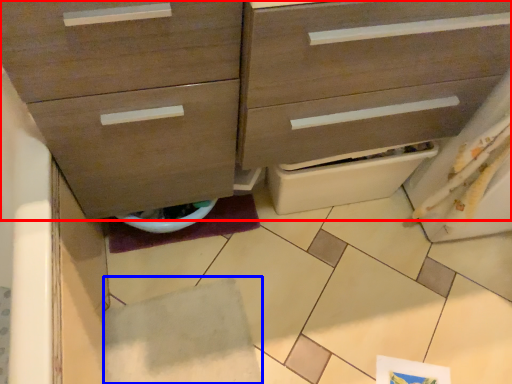
Question: Among these objects, which one is farthest to the camera, chest of drawers (highlighted by a red box) or tile (highlighted by a blue box)?

Choices:
 (A) chest of drawers
 (B) tile

Answer: (B)